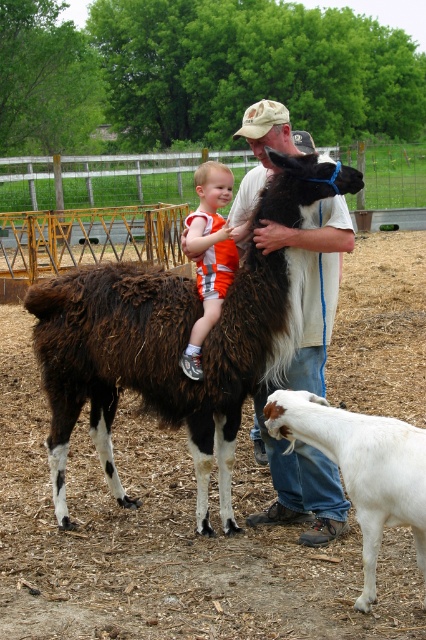
Question: Which object is farther from the camera taking this photo?

Choices:
 (A) orange fabric shorts at center
 (B) light brown cotton shirt at center
 (C) white woolen goat at lower right

Answer: (A)

Question: Does light brown cotton shirt at center appear under white woolen goat at lower right?

Choices:
 (A) yes
 (B) no

Answer: (B)

Question: Among these objects, which one is nearest to the camera?

Choices:
 (A) light brown cotton shirt at center
 (B) orange fabric shorts at center
 (C) white fluffy goat at lower right
 (D) white woolen goat at lower right

Answer: (D)

Question: Is white fluffy goat at lower right smaller than light brown cotton shirt at center?

Choices:
 (A) no
 (B) yes

Answer: (A)

Question: Can you confirm if white fluffy goat at lower right is thinner than white woolen goat at lower right?

Choices:
 (A) yes
 (B) no

Answer: (B)

Question: Which point is farther to the camera?

Choices:
 (A) white fluffy goat at lower right
 (B) light brown cotton shirt at center
 (C) white woolen goat at lower right
 (D) orange fabric shorts at center

Answer: (D)